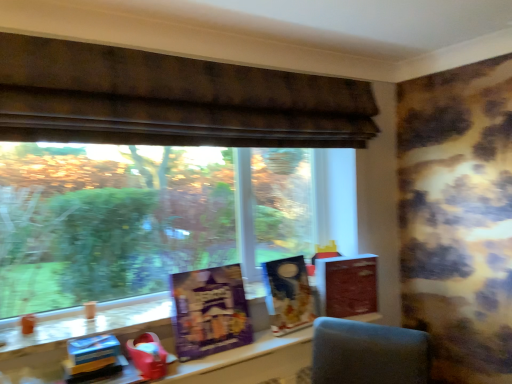
Question: Is shiny red toy at lower left, arranged as the 1th toy when viewed from the right, in contact with matte brown book at right, the first paperback book viewed from the right?

Choices:
 (A) no
 (B) yes

Answer: (A)

Question: Does shiny red toy at lower left, arranged as the 2th toy when viewed from the left, have a lesser width compared to matte brown book at right, the second paperback book from the front?

Choices:
 (A) yes
 (B) no

Answer: (B)

Question: Is shiny red toy at lower left, arranged as the 1th toy when viewed from the right, positioned with its back to matte brown book at right, the second paperback book from the front?

Choices:
 (A) yes
 (B) no

Answer: (B)

Question: Considering the relative sizes of shiny red toy at lower left, arranged as the 2th toy when viewed from the left, and matte brown book at right, the second paperback book from the front, in the image provided, is shiny red toy at lower left, arranged as the 2th toy when viewed from the left, smaller than matte brown book at right, the second paperback book from the front,?

Choices:
 (A) yes
 (B) no

Answer: (A)

Question: Can you confirm if shiny red toy at lower left, arranged as the 2th toy when viewed from the left, is positioned to the right of matte brown book at right, the first paperback book viewed from the right?

Choices:
 (A) yes
 (B) no

Answer: (B)

Question: From a real-world perspective, is shiny red toy at lower left, arranged as the 1th toy when viewed from the right, beneath matte brown book at right, the first paperback book viewed from the right?

Choices:
 (A) no
 (B) yes

Answer: (B)

Question: Does blue cardboard box at lower left, placed as the 1th toy when sorted from left to right, have a lesser width compared to matte plastic table at center?

Choices:
 (A) no
 (B) yes

Answer: (B)

Question: Is blue cardboard box at lower left, which ranks as the 2th toy in right-to-left order, not close to matte plastic table at center?

Choices:
 (A) no
 (B) yes

Answer: (A)

Question: Is blue cardboard box at lower left, which ranks as the 2th toy in right-to-left order, wider than matte plastic table at center?

Choices:
 (A) no
 (B) yes

Answer: (A)

Question: Is blue cardboard box at lower left, placed as the 1th toy when sorted from left to right, directly adjacent to matte plastic table at center?

Choices:
 (A) no
 (B) yes

Answer: (A)

Question: From a real-world perspective, is blue cardboard box at lower left, placed as the 1th toy when sorted from left to right, below matte plastic table at center?

Choices:
 (A) no
 (B) yes

Answer: (A)

Question: From the image's perspective, is blue cardboard box at lower left, which ranks as the 2th toy in right-to-left order, under matte plastic table at center?

Choices:
 (A) no
 (B) yes

Answer: (A)

Question: Is matte brown book at right, the 1th paperback book from the back, facing towards blue cardboard box at lower left, which ranks as the 2th toy in right-to-left order?

Choices:
 (A) no
 (B) yes

Answer: (A)